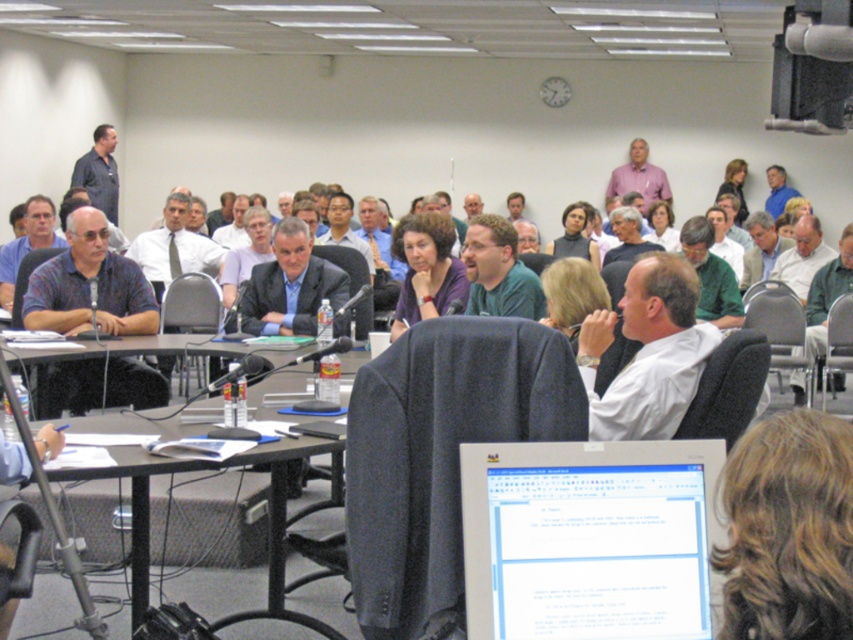
Between dark blue shirt at left and matte blue shirt at center, which one has less height?

matte blue shirt at center

Between dark blue shirt at left and matte blue shirt at center, which one appears on the left side from the viewer's perspective?

Positioned to the left is matte blue shirt at center.

The height and width of the screenshot is (640, 853). Identify the location of dark blue shirt at left. (90, 285).

At what (x,y) coordinates should I click in order to perform the action: click on dark blue shirt at left. Please return your answer as a coordinate pair (x, y). Image resolution: width=853 pixels, height=640 pixels. Looking at the image, I should click on (90, 285).

Is white shirt at center closer to the viewer compared to green matte shirt at center?

Yes, white shirt at center is in front of green matte shirt at center.

Does white shirt at center appear over green matte shirt at center?

No.

Is point (677, 356) less distant than point (469, 248)?

Yes, point (677, 356) is in front of point (469, 248).

Find the location of a particular element. The image size is (853, 640). white shirt at center is located at coordinates (648, 352).

Does black plastic table at center have a lesser height compared to dark blue shirt at upper left?

Yes.

Who is higher up, black plastic table at center or dark blue shirt at upper left?

dark blue shirt at upper left is above.

Image resolution: width=853 pixels, height=640 pixels. I want to click on black plastic table at center, so click(287, 522).

Find the location of a particular element. The width and height of the screenshot is (853, 640). black plastic table at center is located at coordinates (287, 522).